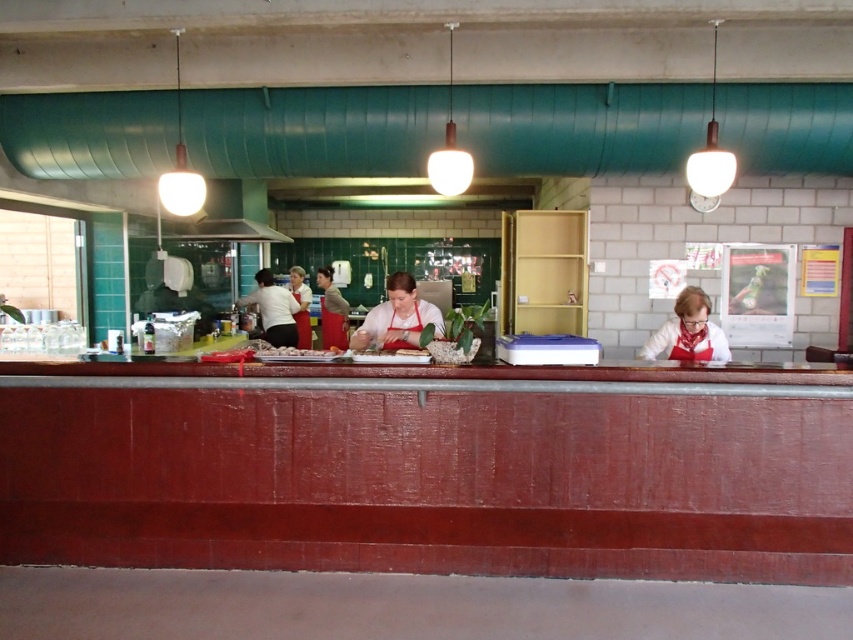
You are a customer standing in front of the smooth red wood counter at center and the white glossy tray at center. Which object is nearer to you?

The smooth red wood counter at center is closer to the viewer than the white glossy tray at center, so the smooth red wood counter at center is nearer to you.